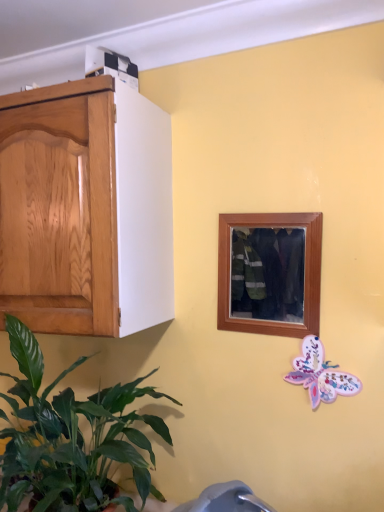
Question: In the image, is wooden picture frame at center positioned in front of or behind green leafy plant at lower left?

Choices:
 (A) behind
 (B) front

Answer: (A)

Question: From their relative heights in the image, would you say wooden picture frame at center is taller or shorter than green leafy plant at lower left?

Choices:
 (A) tall
 (B) short

Answer: (B)

Question: Which is farther from the pastel paper butterfly at lower right?

Choices:
 (A) green leafy plant at lower left
 (B) wooden picture frame at center

Answer: (A)

Question: Based on their relative distances, which object is nearer to the pastel paper butterfly at lower right?

Choices:
 (A) wooden picture frame at center
 (B) green leafy plant at lower left

Answer: (A)